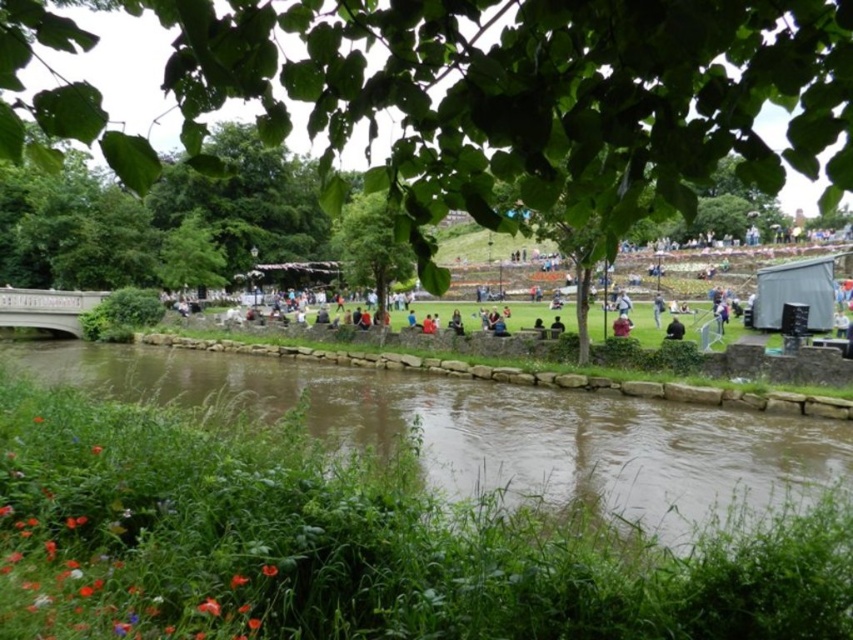
Which of these two, green leafy tree at upper center or brown stone river at lower center, stands taller?

Standing taller between the two is green leafy tree at upper center.

You are a GUI agent. You are given a task and a screenshot of the screen. Output one action in this format:
    pyautogui.click(x=<x>, y=<y>)
    Task: Click on the green leafy tree at upper center
    This screenshot has height=640, width=853.
    Given the screenshot: What is the action you would take?
    pyautogui.click(x=525, y=97)

Between point (258, 88) and point (788, 435), which one is positioned behind?

The point (788, 435) is more distant.

Locate an element on the screen. green leafy tree at upper center is located at coordinates (525, 97).

At what (x,y) coordinates should I click in order to perform the action: click on brown stone river at lower center. Please return your answer as a coordinate pair (x, y). The width and height of the screenshot is (853, 640). Looking at the image, I should click on (497, 429).

Consider the image. Does brown stone river at lower center have a lesser width compared to green leafy tree at center?

No, brown stone river at lower center is not thinner than green leafy tree at center.

Who is more distant from viewer, [631,481] or [361,220]?

Point [361,220]

Where is `brown stone river at lower center`? brown stone river at lower center is located at coordinates (497, 429).

Is green leafy tree at upper center bigger than green leafy tree at center?

Correct, green leafy tree at upper center is larger in size than green leafy tree at center.

Based on the photo, is green leafy tree at upper center wider than green leafy tree at center?

Yes.

Between point (352, 74) and point (393, 237), which one is positioned in front?

Point (352, 74) is in front.

This screenshot has height=640, width=853. What are the coordinates of `green leafy tree at upper center` in the screenshot? It's located at (525, 97).